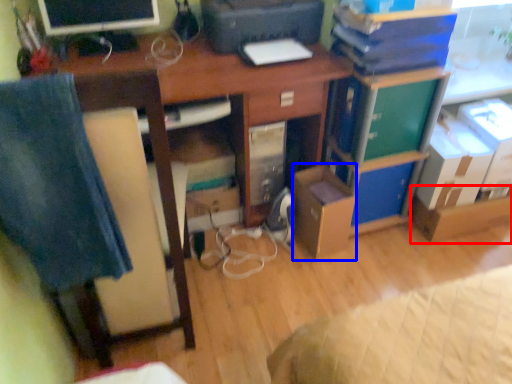
Question: Which object is closer to the camera taking this photo, cardboard box (highlighted by a red box) or cardboard box (highlighted by a blue box)?

Choices:
 (A) cardboard box
 (B) cardboard box

Answer: (B)